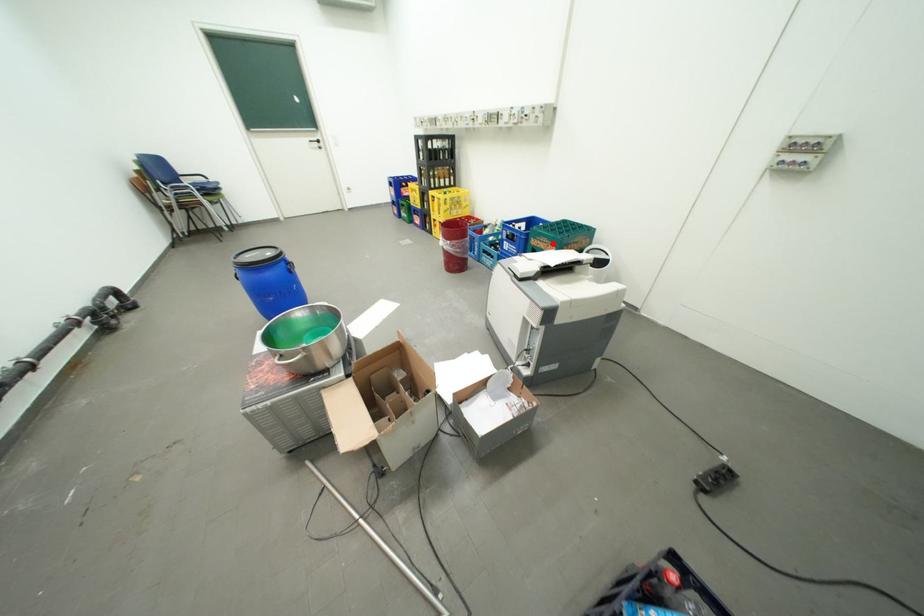
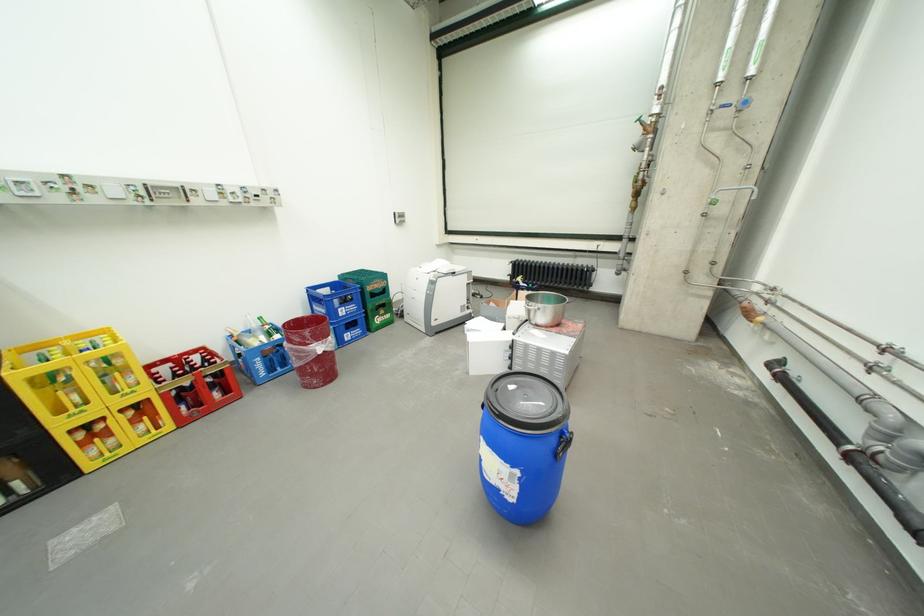
Question: I am providing you with two images of the same scene from different viewpoints. A red point is marked on the first image. Is the red point's position out of view in image 2?

Choices:
 (A) Yes
 (B) No

Answer: (B)